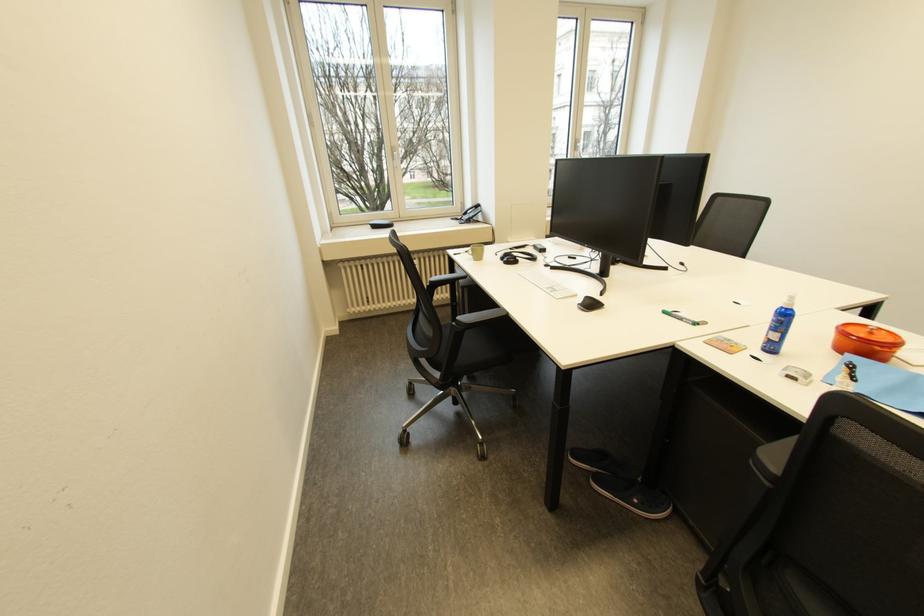
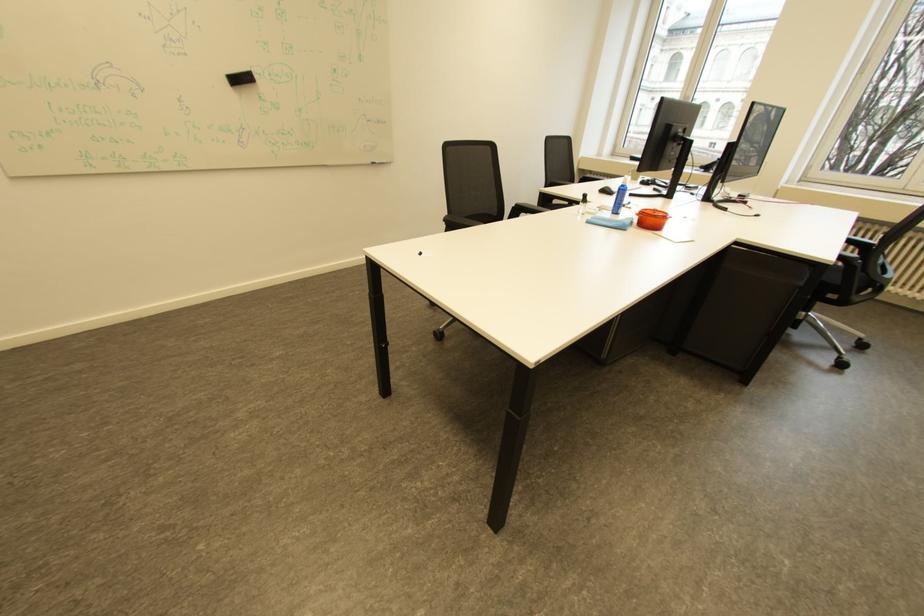
In the second image, find the point that corresponds to (599,302) in the first image.

(617, 191)